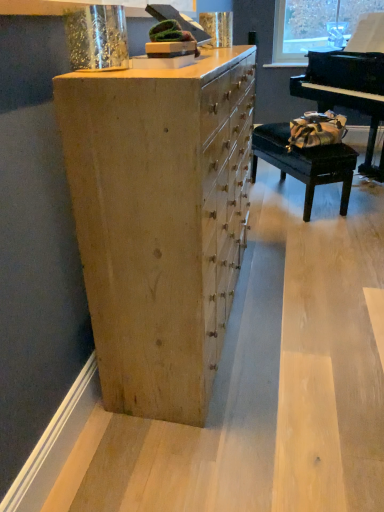
Locate an element on the screen. The height and width of the screenshot is (512, 384). free point below black leather table at right (from a real-world perspective) is located at coordinates (299, 202).